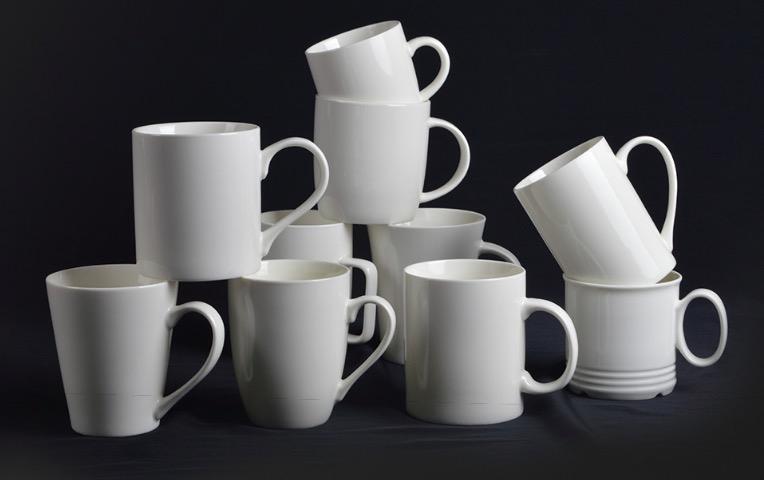
You are a GUI agent. You are given a task and a screenshot of the screen. Output one action in this format:
    pyautogui.click(x=<x>, y=<y>)
    Task: Click on the cups for drinking coffee
    Image resolution: width=764 pixels, height=480 pixels.
    Given the screenshot: What is the action you would take?
    pyautogui.click(x=134, y=337), pyautogui.click(x=192, y=224), pyautogui.click(x=303, y=332), pyautogui.click(x=325, y=248), pyautogui.click(x=477, y=362), pyautogui.click(x=461, y=241), pyautogui.click(x=406, y=186), pyautogui.click(x=390, y=81), pyautogui.click(x=578, y=193), pyautogui.click(x=636, y=335)